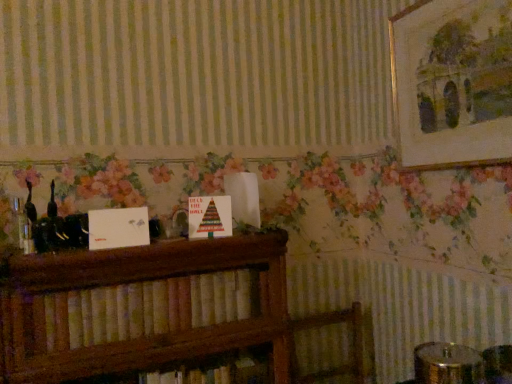
Question: Is gold-framed painting at upper right situated inside wooden bookshelf at center or outside?

Choices:
 (A) outside
 (B) inside

Answer: (A)

Question: In the image, is gold-framed painting at upper right positioned in front of or behind wooden bookshelf at center?

Choices:
 (A) behind
 (B) front

Answer: (A)

Question: Is gold-framed painting at upper right wider or thinner than wooden bookshelf at center?

Choices:
 (A) wide
 (B) thin

Answer: (B)

Question: Considering the relative positions of wooden bookshelf at center and gold-framed painting at upper right in the image provided, is wooden bookshelf at center to the left or to the right of gold-framed painting at upper right?

Choices:
 (A) right
 (B) left

Answer: (B)

Question: Would you say wooden bookshelf at center is inside or outside gold-framed painting at upper right?

Choices:
 (A) inside
 (B) outside

Answer: (B)

Question: From the image's perspective, relative to gold-framed painting at upper right, is wooden bookshelf at center above or below?

Choices:
 (A) below
 (B) above

Answer: (A)

Question: In terms of height, does wooden bookshelf at center look taller or shorter compared to gold-framed painting at upper right?

Choices:
 (A) short
 (B) tall

Answer: (A)